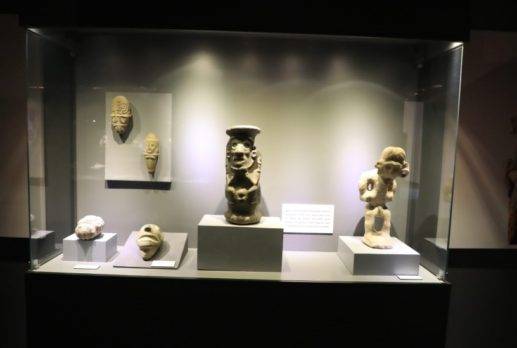
You are a GUI agent. You are given a task and a screenshot of the screen. Output one action in this format:
    pyautogui.click(x=<x>, y=<y>)
    Task: Click on the display backdrops
    This screenshot has height=348, width=517.
    Given the screenshot: What is the action you would take?
    pyautogui.click(x=307, y=116), pyautogui.click(x=18, y=125), pyautogui.click(x=482, y=145)